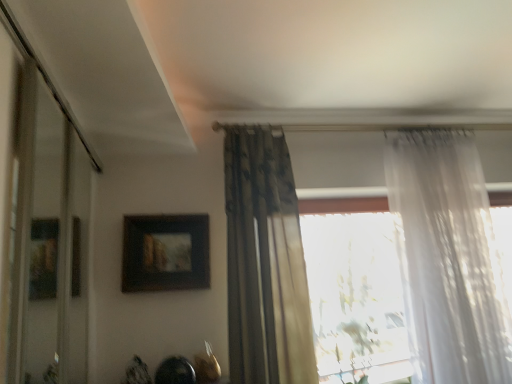
Measure the distance between transparent glass door at left and camera.

transparent glass door at left is 1.02 meters away from camera.

This screenshot has width=512, height=384. What do you see at coordinates (265, 263) in the screenshot?
I see `dark floral fabric curtain at center, the second curtain positioned from the right` at bounding box center [265, 263].

This screenshot has width=512, height=384. What do you see at coordinates (165, 253) in the screenshot? I see `matte black picture frame at upper center` at bounding box center [165, 253].

Identify the location of sheer white curtain at right, marked as the 1th curtain in a right-to-left arrangement. (447, 258).

Is matte black picture frame at upper center situated inside sheer white curtain at right, the 2th curtain in the left-to-right sequence, or outside?

matte black picture frame at upper center is outside sheer white curtain at right, the 2th curtain in the left-to-right sequence.

Can you tell me how much matte black picture frame at upper center and sheer white curtain at right, marked as the 1th curtain in a right-to-left arrangement, differ in facing direction?

1.94 degrees separate the facing orientations of matte black picture frame at upper center and sheer white curtain at right, marked as the 1th curtain in a right-to-left arrangement.

Is matte black picture frame at upper center oriented away from sheer white curtain at right, the 2th curtain in the left-to-right sequence?

No.

Would you say transparent glass door at left contains dark floral fabric curtain at center, the second curtain positioned from the right?

Actually, dark floral fabric curtain at center, the second curtain positioned from the right, is outside transparent glass door at left.

Is the position of transparent glass door at left more distant than that of dark floral fabric curtain at center, which appears as the first curtain when viewed from the left?

No, transparent glass door at left is closer to the camera.

Is dark floral fabric curtain at center, which appears as the first curtain when viewed from the left, at the back of transparent glass door at left?

That's not correct — transparent glass door at left is not looking away from dark floral fabric curtain at center, which appears as the first curtain when viewed from the left.

In terms of height, does transparent glass door at left look taller or shorter compared to dark floral fabric curtain at center, the second curtain positioned from the right?

A: Considering their sizes, transparent glass door at left has less height than dark floral fabric curtain at center, the second curtain positioned from the right.

How different are the orientations of matte black picture frame at upper center and dark floral fabric curtain at center, the second curtain positioned from the right, in degrees?

0.227 degrees.

Which is more to the right, matte black picture frame at upper center or dark floral fabric curtain at center, the second curtain positioned from the right?

From the viewer's perspective, dark floral fabric curtain at center, the second curtain positioned from the right, appears more on the right side.

From the picture: Would you say dark floral fabric curtain at center, the second curtain positioned from the right, is part of matte black picture frame at upper center's contents?

Actually, dark floral fabric curtain at center, the second curtain positioned from the right, is outside matte black picture frame at upper center.

Is matte black picture frame at upper center facing towards dark floral fabric curtain at center, which appears as the first curtain when viewed from the left?

No, matte black picture frame at upper center is not oriented towards dark floral fabric curtain at center, which appears as the first curtain when viewed from the left.

Is matte black picture frame at upper center at the back of dark floral fabric curtain at center, which appears as the first curtain when viewed from the left?

That's not correct — dark floral fabric curtain at center, which appears as the first curtain when viewed from the left, is not looking away from matte black picture frame at upper center.

Is dark floral fabric curtain at center, which appears as the first curtain when viewed from the left, beside matte black picture frame at upper center?

dark floral fabric curtain at center, which appears as the first curtain when viewed from the left, and matte black picture frame at upper center are clearly separated.

Based on the photo, from a real-world perspective, between dark floral fabric curtain at center, the second curtain positioned from the right, and matte black picture frame at upper center, who is vertically higher?

In real-world perspective, matte black picture frame at upper center is above.

From their relative heights in the image, would you say dark floral fabric curtain at center, the second curtain positioned from the right, is taller or shorter than matte black picture frame at upper center?

Clearly, dark floral fabric curtain at center, the second curtain positioned from the right, is taller compared to matte black picture frame at upper center.

Between sheer white curtain at right, marked as the 1th curtain in a right-to-left arrangement, and transparent glass door at left, which one appears on the left side from the viewer's perspective?

transparent glass door at left is more to the left.

Considering the relative sizes of sheer white curtain at right, marked as the 1th curtain in a right-to-left arrangement, and transparent glass door at left in the image provided, is sheer white curtain at right, marked as the 1th curtain in a right-to-left arrangement, smaller than transparent glass door at left?

Actually, sheer white curtain at right, marked as the 1th curtain in a right-to-left arrangement, might be larger than transparent glass door at left.

Is sheer white curtain at right, the 2th curtain in the left-to-right sequence, shorter than transparent glass door at left?

In fact, sheer white curtain at right, the 2th curtain in the left-to-right sequence, may be taller than transparent glass door at left.

From a real-world perspective, starting from the matte black picture frame at upper center, which curtain is the 2nd one below it? Please provide its 2D coordinates.

[(447, 258)]

Considering the sizes of objects sheer white curtain at right, marked as the 1th curtain in a right-to-left arrangement, and matte black picture frame at upper center in the image provided, who is smaller, sheer white curtain at right, marked as the 1th curtain in a right-to-left arrangement, or matte black picture frame at upper center?

matte black picture frame at upper center is smaller.

Can you tell me how much sheer white curtain at right, marked as the 1th curtain in a right-to-left arrangement, and matte black picture frame at upper center differ in facing direction?

There is a 1.94-degree angle between the facing directions of sheer white curtain at right, marked as the 1th curtain in a right-to-left arrangement, and matte black picture frame at upper center.

Is sheer white curtain at right, the 2th curtain in the left-to-right sequence, positioned far away from matte black picture frame at upper center?

Indeed, sheer white curtain at right, the 2th curtain in the left-to-right sequence, is not near matte black picture frame at upper center.

Consider the image. Which is closer to the camera, (31, 52) or (411, 346)?

The point (31, 52) is more forward.

Considering the relative sizes of transparent glass door at left and sheer white curtain at right, the 2th curtain in the left-to-right sequence, in the image provided, is transparent glass door at left bigger than sheer white curtain at right, the 2th curtain in the left-to-right sequence,?

No.

Does transparent glass door at left lie in front of sheer white curtain at right, marked as the 1th curtain in a right-to-left arrangement?

Yes, the depth of transparent glass door at left is less than that of sheer white curtain at right, marked as the 1th curtain in a right-to-left arrangement.

Which of these two, transparent glass door at left or sheer white curtain at right, the 2th curtain in the left-to-right sequence, stands shorter?

With less height is transparent glass door at left.

The width and height of the screenshot is (512, 384). Identify the location of picture frame behind the sheer white curtain at right, the 2th curtain in the left-to-right sequence. (165, 253).

What are the coordinates of `glass door lying in front of the dark floral fabric curtain at center, the second curtain positioned from the right` in the screenshot? It's located at (45, 234).

Estimate the real-world distances between objects in this image. Which object is closer to matte black picture frame at upper center, dark floral fabric curtain at center, the second curtain positioned from the right, or transparent glass door at left?

dark floral fabric curtain at center, the second curtain positioned from the right, is positioned closer to the anchor matte black picture frame at upper center.

When comparing their distances from transparent glass door at left, does sheer white curtain at right, marked as the 1th curtain in a right-to-left arrangement, or dark floral fabric curtain at center, which appears as the first curtain when viewed from the left, seem closer?

Based on the image, dark floral fabric curtain at center, which appears as the first curtain when viewed from the left, appears to be nearer to transparent glass door at left.

Considering their positions, is transparent glass door at left positioned closer to dark floral fabric curtain at center, the second curtain positioned from the right, than matte black picture frame at upper center?

matte black picture frame at upper center is positioned closer to the anchor dark floral fabric curtain at center, the second curtain positioned from the right.

Estimate the real-world distances between objects in this image. Which object is further from transparent glass door at left, sheer white curtain at right, marked as the 1th curtain in a right-to-left arrangement, or matte black picture frame at upper center?

sheer white curtain at right, marked as the 1th curtain in a right-to-left arrangement, lies further to transparent glass door at left than the other object.

Looking at the image, which one is located further to transparent glass door at left, dark floral fabric curtain at center, which appears as the first curtain when viewed from the left, or matte black picture frame at upper center?

dark floral fabric curtain at center, which appears as the first curtain when viewed from the left, is positioned further to the anchor transparent glass door at left.

Looking at the image, which one is located further to sheer white curtain at right, the 2th curtain in the left-to-right sequence, matte black picture frame at upper center or transparent glass door at left?

transparent glass door at left.

When comparing their distances from sheer white curtain at right, the 2th curtain in the left-to-right sequence, does transparent glass door at left or dark floral fabric curtain at center, the second curtain positioned from the right, seem further?

transparent glass door at left.

From the image, which object appears to be farther from dark floral fabric curtain at center, which appears as the first curtain when viewed from the left, matte black picture frame at upper center or transparent glass door at left?

Among the two, transparent glass door at left is located further to dark floral fabric curtain at center, which appears as the first curtain when viewed from the left.

At what (x,y) coordinates should I click in order to perform the action: click on curtain between matte black picture frame at upper center and sheer white curtain at right, the 2th curtain in the left-to-right sequence, in the horizontal direction. Please return your answer as a coordinate pair (x, y). Looking at the image, I should click on pos(265,263).

The height and width of the screenshot is (384, 512). In order to click on picture frame situated between transparent glass door at left and sheer white curtain at right, marked as the 1th curtain in a right-to-left arrangement, from left to right in this screenshot , I will do `click(165, 253)`.

Find the location of `curtain located between transparent glass door at left and sheer white curtain at right, marked as the 1th curtain in a right-to-left arrangement, in the left-right direction`. curtain located between transparent glass door at left and sheer white curtain at right, marked as the 1th curtain in a right-to-left arrangement, in the left-right direction is located at coordinates (265, 263).